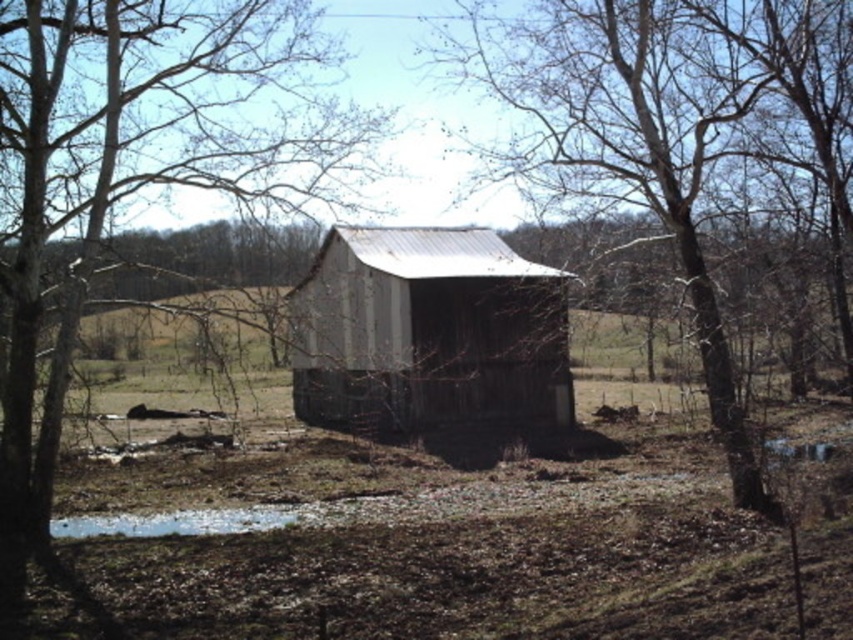
Question: Based on their relative distances, which object is farther from the white matte puddle at lower center?

Choices:
 (A) brown rough wood tree at center
 (B) weathered wood barn at center
 (C) brown bark tree at left

Answer: (B)

Question: Does brown rough wood tree at center have a smaller size compared to white matte puddle at lower center?

Choices:
 (A) yes
 (B) no

Answer: (B)

Question: Which object appears farthest from the camera in this image?

Choices:
 (A) brown rough wood tree at center
 (B) weathered wood barn at center
 (C) brown bark tree at left

Answer: (A)

Question: Can you confirm if weathered wood barn at center is bigger than white matte puddle at lower center?

Choices:
 (A) yes
 (B) no

Answer: (A)

Question: Does weathered wood barn at center come in front of white matte puddle at lower center?

Choices:
 (A) no
 (B) yes

Answer: (B)

Question: Considering the real-world distances, which object is closest to the brown bark tree at left?

Choices:
 (A) weathered wood barn at center
 (B) brown rough wood tree at center
 (C) white matte puddle at lower center

Answer: (B)